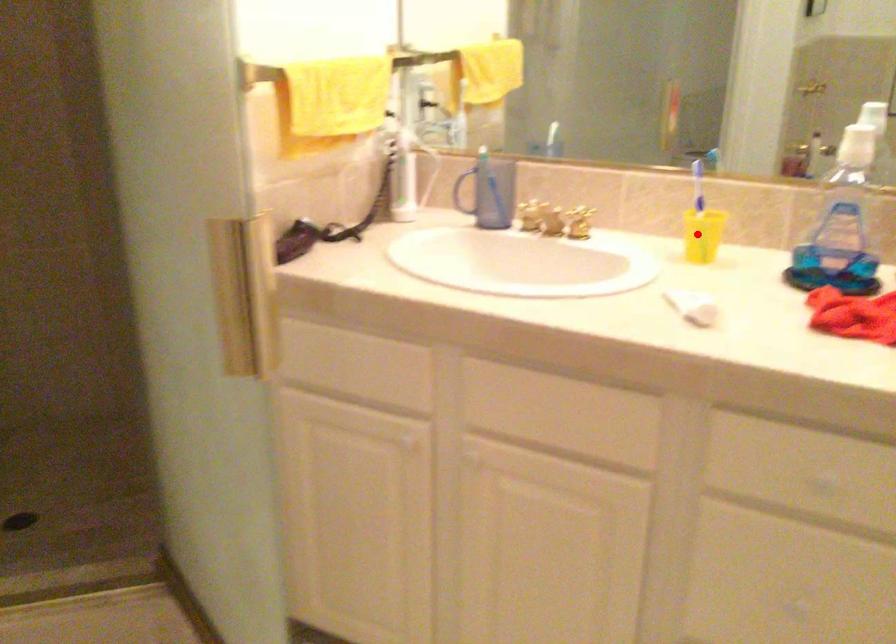
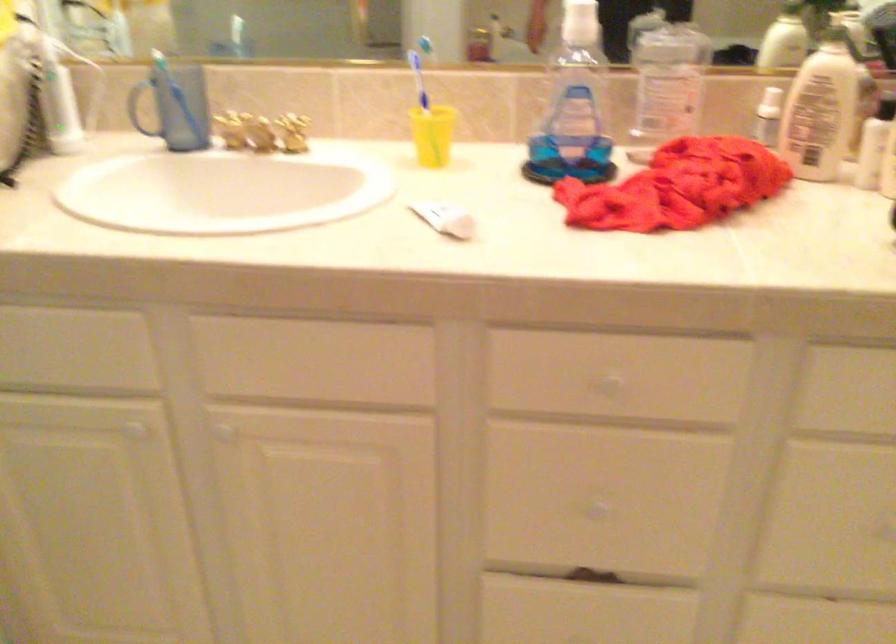
Question: A red point is marked in image1. In image2, is the corresponding 3D point closer to the camera or farther? Reply with the corresponding letter.

Choices:
 (A) The corresponding 3D point is closer.
 (B) The corresponding 3D point is farther.

Answer: (A)